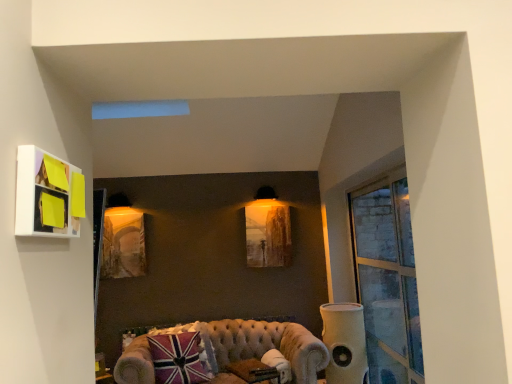
Question: From the image's perspective, is matte gold picture frame at center, placed as the 3th picture frame when sorted from right to left, below matte wooden picture frame at center, positioned as the 3th picture frame in left-to-right order?

Choices:
 (A) no
 (B) yes

Answer: (B)

Question: Can you confirm if matte gold picture frame at center, which is the 1th picture frame from left to right, is taller than matte wooden picture frame at center, the first picture frame viewed from the right?

Choices:
 (A) no
 (B) yes

Answer: (B)

Question: Are matte gold picture frame at center, placed as the 3th picture frame when sorted from right to left, and matte wooden picture frame at center, which is counted as the 3th picture frame, starting from the front, located far from each other?

Choices:
 (A) no
 (B) yes

Answer: (B)

Question: Does matte gold picture frame at center, the 2th picture frame when ordered from back to front, have a lesser height compared to matte wooden picture frame at center, which is counted as the 3th picture frame, starting from the front?

Choices:
 (A) yes
 (B) no

Answer: (B)

Question: Does matte gold picture frame at center, which is the 1th picture frame from left to right, have a lesser width compared to matte wooden picture frame at center, the first picture frame positioned from the back?

Choices:
 (A) no
 (B) yes

Answer: (A)

Question: From a real-world perspective, does matte gold picture frame at center, the 2th picture frame viewed from the front, sit lower than matte wooden picture frame at center, the first picture frame positioned from the back?

Choices:
 (A) yes
 (B) no

Answer: (A)

Question: Is matte white picture frame at upper left, which is the third picture frame in back-to-front order, thinner than clear glass window at right?

Choices:
 (A) yes
 (B) no

Answer: (B)

Question: Does matte white picture frame at upper left, the second picture frame in the right-to-left sequence, have a larger size compared to clear glass window at right?

Choices:
 (A) no
 (B) yes

Answer: (A)

Question: From the image's perspective, is matte white picture frame at upper left, which ranks as the 2th picture frame in left-to-right order, below clear glass window at right?

Choices:
 (A) yes
 (B) no

Answer: (B)

Question: From a real-world perspective, is matte white picture frame at upper left, which is the third picture frame in back-to-front order, on top of clear glass window at right?

Choices:
 (A) yes
 (B) no

Answer: (A)

Question: Is matte white picture frame at upper left, which ranks as the 2th picture frame in left-to-right order, positioned in front of clear glass window at right?

Choices:
 (A) no
 (B) yes

Answer: (B)

Question: Is matte white picture frame at upper left, which is the third picture frame in back-to-front order, wider than clear glass window at right?

Choices:
 (A) yes
 (B) no

Answer: (A)

Question: Considering the relative sizes of clear glass window at right and matte wooden picture frame at center, the first picture frame positioned from the back, in the image provided, is clear glass window at right wider than matte wooden picture frame at center, the first picture frame positioned from the back,?

Choices:
 (A) no
 (B) yes

Answer: (B)